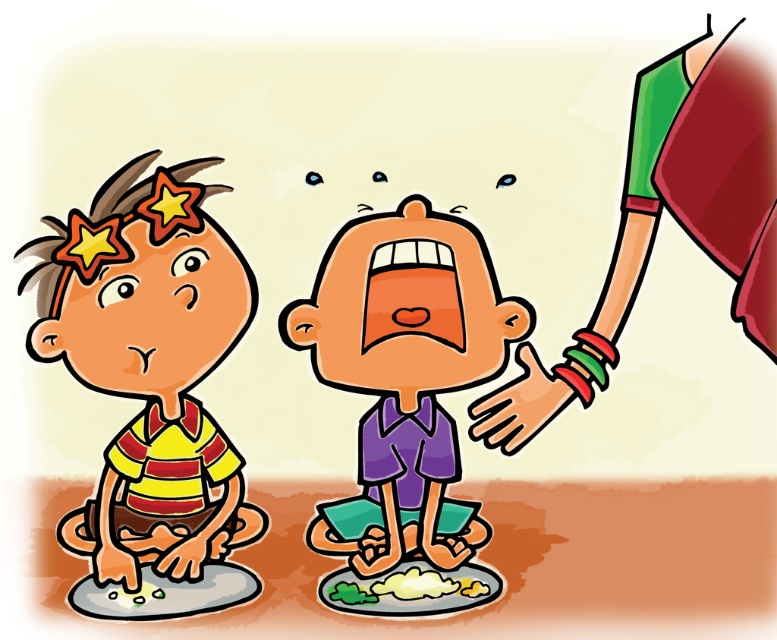
You are a parent trying to decide which shirt to buy for your two sons. The yellow striped shirt at left and the purple matte shirt at center are both available. Based on the image, which shirt would you choose for the taller son?

The yellow striped shirt at left is taller than the purple matte shirt at center, so the parent should choose the yellow striped shirt at left for the taller son.

You are a tailor who needs to adjust the sleeves of both the yellow striped shirt at left and the purple matte shirt at center. Which shirt requires longer sleeves to match the wearer?

The yellow striped shirt at left requires longer sleeves because it has a larger size compared to the purple matte shirt at center.